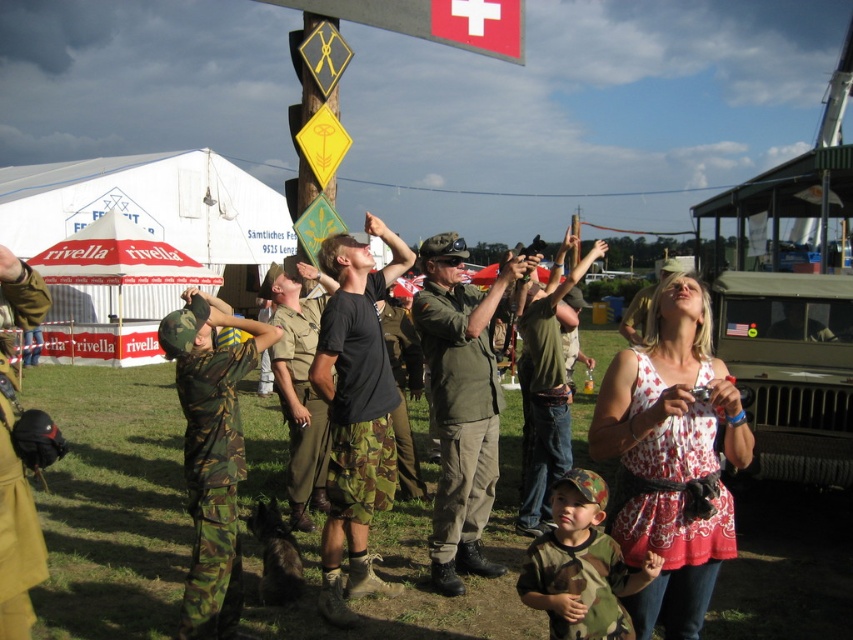
You are standing at the gathering and want to move from point A to point B. Point A is located at coordinate point (355,504) and point B is at coordinate point (532,592). Which point is closer to you when you start at point A?

Point A is closer to you since it is the starting point, and point B is further away as per the description.

You are a photographer standing at the center of the scene. You want to take a photo of the camouflage fabric helmet at left. Where should you position your camera to capture it in the frame?

The camouflage fabric helmet at left is located at point (16, 538), so you should position your camera to the left side of the scene to capture it in the frame.